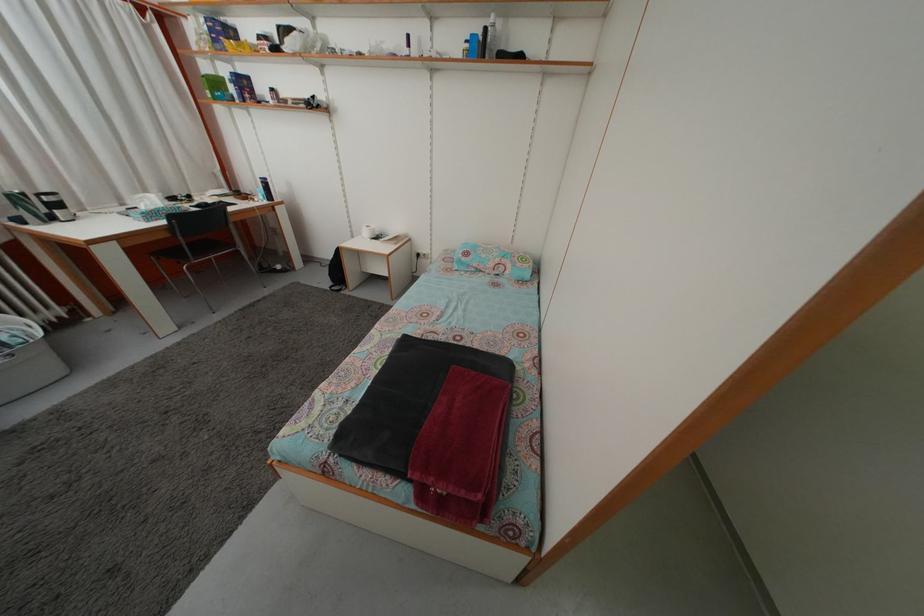
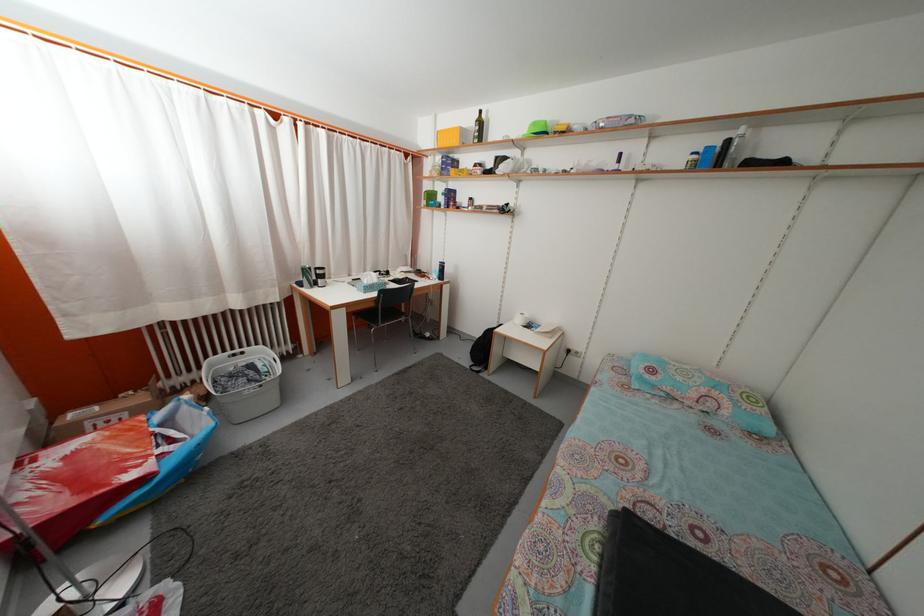
In the second image, find the point that corresponds to point 335,262 in the first image.

(482, 342)